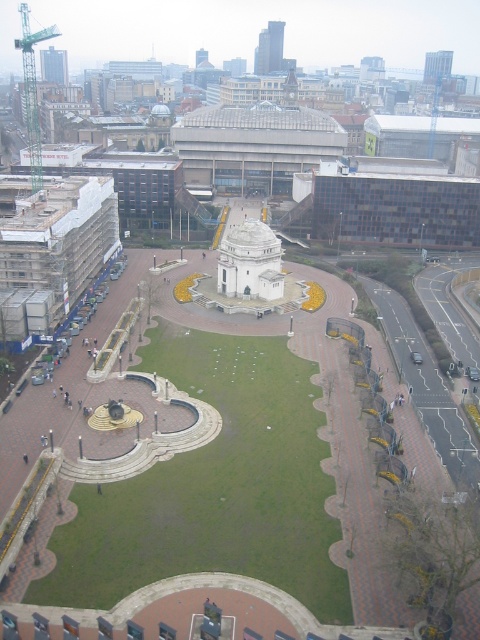
Question: Does green metallic crane at upper left have a larger size compared to glassy skyscraper at upper right?

Choices:
 (A) no
 (B) yes

Answer: (B)

Question: Is matte glass tower at upper left wider than glassy skyscraper at upper right?

Choices:
 (A) yes
 (B) no

Answer: (A)

Question: Among these objects, which one is farthest from the camera?

Choices:
 (A) matte glass tower at upper left
 (B) green metallic crane at upper left
 (C) smooth glass skyscraper at upper center

Answer: (A)

Question: Can you confirm if smooth glass skyscraper at upper center is positioned to the right of matte glass tower at upper left?

Choices:
 (A) no
 (B) yes

Answer: (B)

Question: Which point is closer to the camera?

Choices:
 (A) (423, 68)
 (B) (51, 58)

Answer: (B)

Question: Which point is closer to the camera?

Choices:
 (A) (272, 56)
 (B) (40, 179)

Answer: (B)